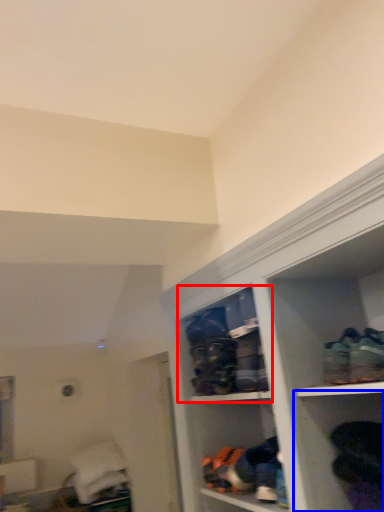
Question: Which of the following is the farthest to the observer, cabinet (highlighted by a red box) or shelf (highlighted by a blue box)?

Choices:
 (A) cabinet
 (B) shelf

Answer: (A)